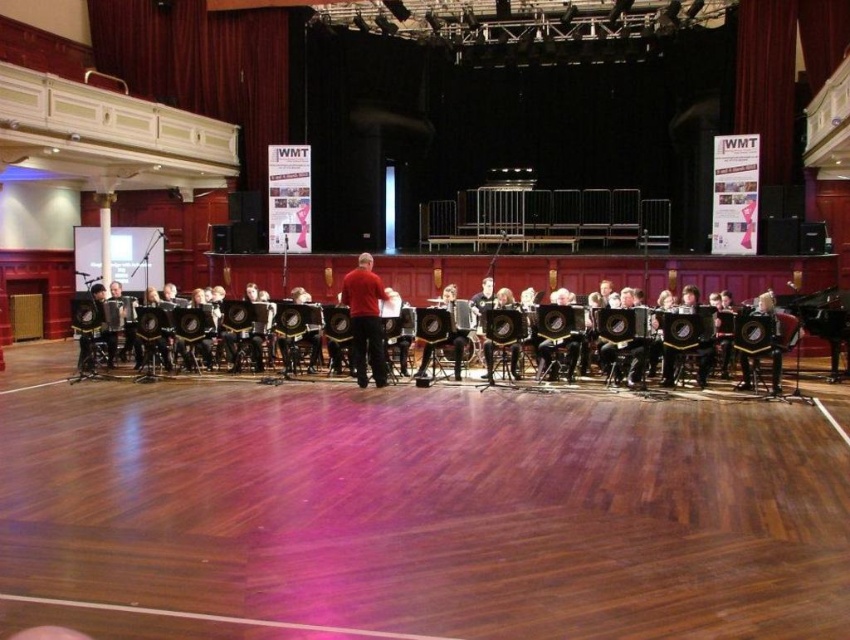
Between wooden floor at center and black leather accordion at center, which one has more height?

Standing taller between the two is black leather accordion at center.

How much distance is there between wooden floor at center and black leather accordion at center?

A distance of 10.83 feet exists between wooden floor at center and black leather accordion at center.

From the picture: Who is more forward, (638, 515) or (349, 307)?

Point (638, 515)

Find the location of a particular element. wooden floor at center is located at coordinates (414, 512).

Consider the image. Can you confirm if black leather accordion at center is positioned above matte red shirt at center?

Yes, black leather accordion at center is above matte red shirt at center.

Is point (327, 317) more distant than point (381, 332)?

Yes, point (327, 317) is farther from viewer.

This screenshot has height=640, width=850. In order to click on black leather accordion at center in this screenshot , I will do `click(605, 332)`.

Between point (132, 492) and point (361, 305), which one is positioned behind?

The point (361, 305) is more distant.

Does wooden floor at center appear under matte red shirt at center?

Correct, wooden floor at center is located below matte red shirt at center.

Does point (714, 624) lie in front of point (348, 278)?

Yes.

Identify the location of wooden floor at center. (414, 512).